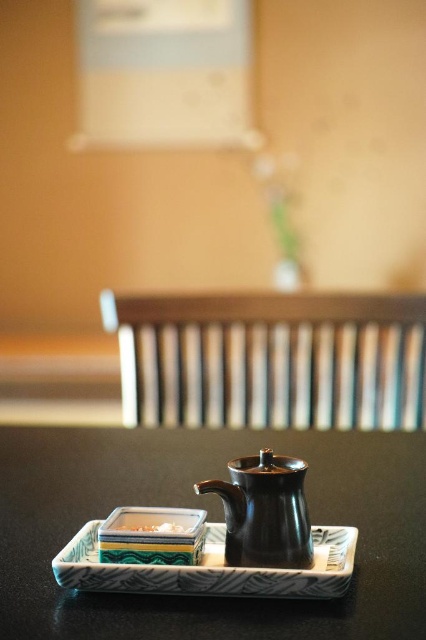
Where is `black ceramic teapot at center`? The height and width of the screenshot is (640, 426). black ceramic teapot at center is located at coordinates (264, 512).

How distant is matte black tray at center from black ceramic teapot at center?

The distance of matte black tray at center from black ceramic teapot at center is 10.88 inches.

Is point (100, 444) positioned behind point (250, 545)?

Yes, point (100, 444) is behind point (250, 545).

This screenshot has height=640, width=426. Describe the element at coordinates (212, 520) in the screenshot. I see `matte black tray at center` at that location.

Locate an element on the screen. matte black tray at center is located at coordinates (212, 520).

What are the coordinates of `patterned ceramic tray at center` in the screenshot? It's located at (210, 570).

Does patterned ceramic tray at center appear on the right side of white glossy rectangular plate at center?

Indeed, patterned ceramic tray at center is positioned on the right side of white glossy rectangular plate at center.

Is point (141, 588) more distant than point (163, 525)?

No, (141, 588) is closer to viewer.

Locate an element on the screen. This screenshot has height=640, width=426. patterned ceramic tray at center is located at coordinates (210, 570).